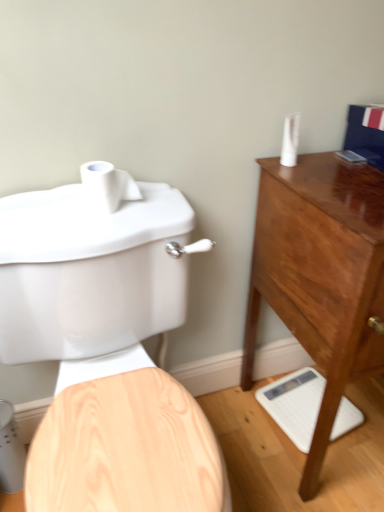
Image resolution: width=384 pixels, height=512 pixels. Identify the location of free space in front of white glossy scale at lower right. (324, 473).